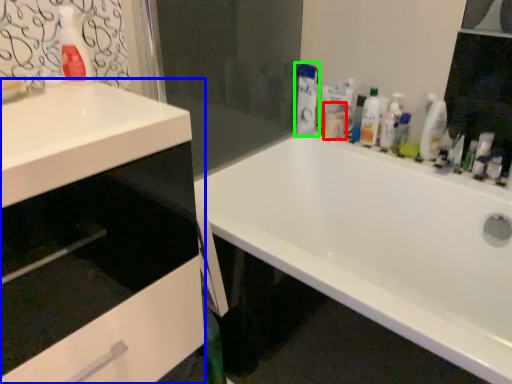
Question: Which is nearer to the toiletry (highlighted by a red box)? cabinetry (highlighted by a blue box) or cleaning product (highlighted by a green box).

Choices:
 (A) cabinetry
 (B) cleaning product

Answer: (B)